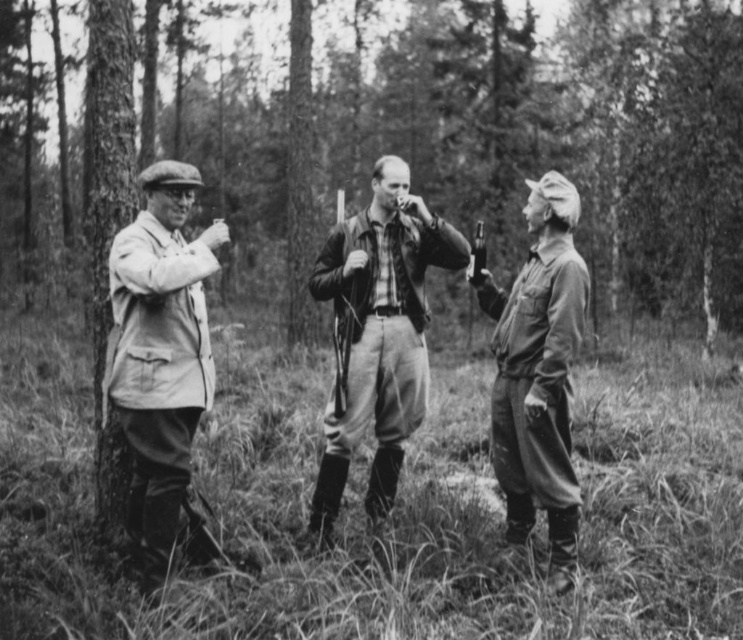
Can you confirm if smooth bark tree at center is smaller than matte khaki shirt at center?

Incorrect, smooth bark tree at center is not smaller in size than matte khaki shirt at center.

Is point (620, 150) closer to camera compared to point (516, 392)?

No.

Is point (363, 51) more distant than point (515, 362)?

That is True.

In order to click on smooth bark tree at center in this screenshot , I will do `click(490, 140)`.

The width and height of the screenshot is (743, 640). Describe the element at coordinates (490, 140) in the screenshot. I see `smooth bark tree at center` at that location.

Is point (103, 326) positioned behind point (363, 307)?

Yes.

This screenshot has width=743, height=640. Describe the element at coordinates (490, 140) in the screenshot. I see `smooth bark tree at center` at that location.

At what (x,y) coordinates should I click in order to perform the action: click on smooth bark tree at center. Please return your answer as a coordinate pair (x, y). The height and width of the screenshot is (640, 743). Looking at the image, I should click on (490, 140).

Who is higher up, light beige fabric coat at left or leather jacket at center?

leather jacket at center

What do you see at coordinates (160, 356) in the screenshot? I see `light beige fabric coat at left` at bounding box center [160, 356].

Is point (149, 385) farther from viewer compared to point (426, 372)?

That is False.

Locate an element on the screen. The image size is (743, 640). light beige fabric coat at left is located at coordinates (160, 356).